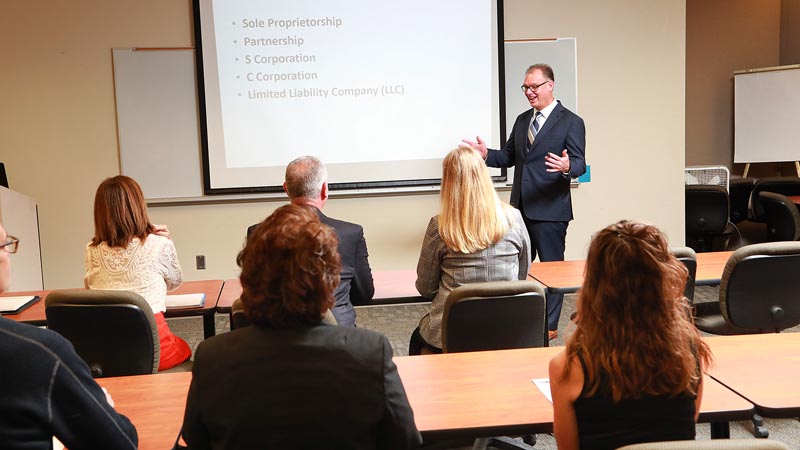
At what (x,y) coordinates should I click in order to perform the action: click on chairs. Please return your answer as a coordinate pair (x, y). The height and width of the screenshot is (450, 800). Looking at the image, I should click on (501, 320), (110, 326), (237, 318), (689, 258), (757, 259), (654, 447).